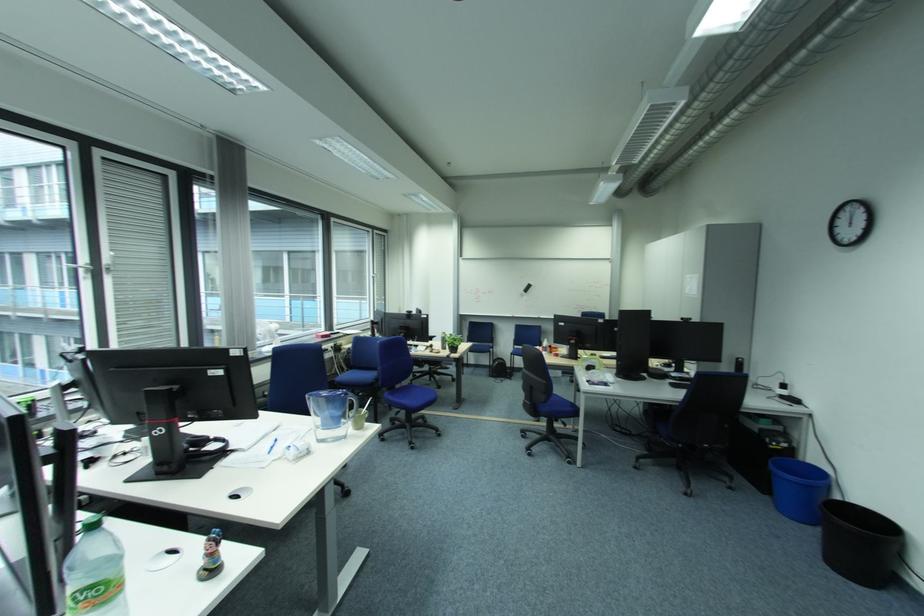
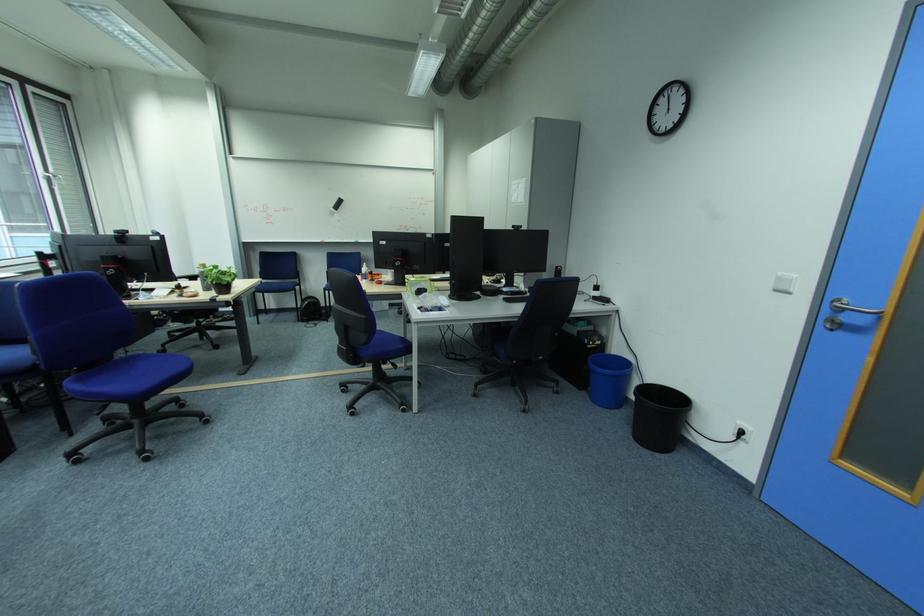
In the second image, find the point that corresponds to point 459,346 in the first image.

(224, 284)